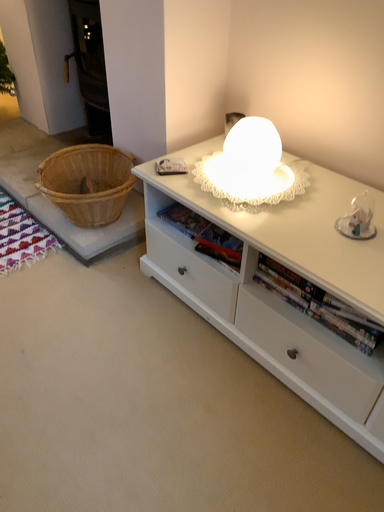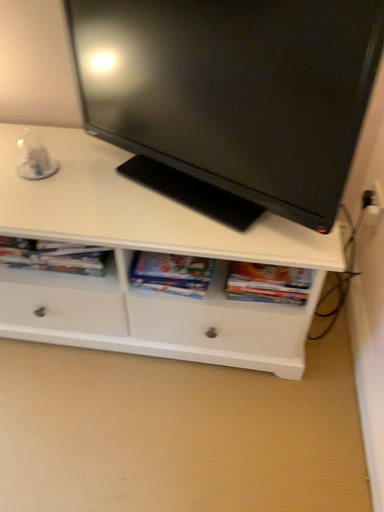
Question: Which way did the camera rotate in the video?

Choices:
 (A) rotated left
 (B) rotated right

Answer: (B)